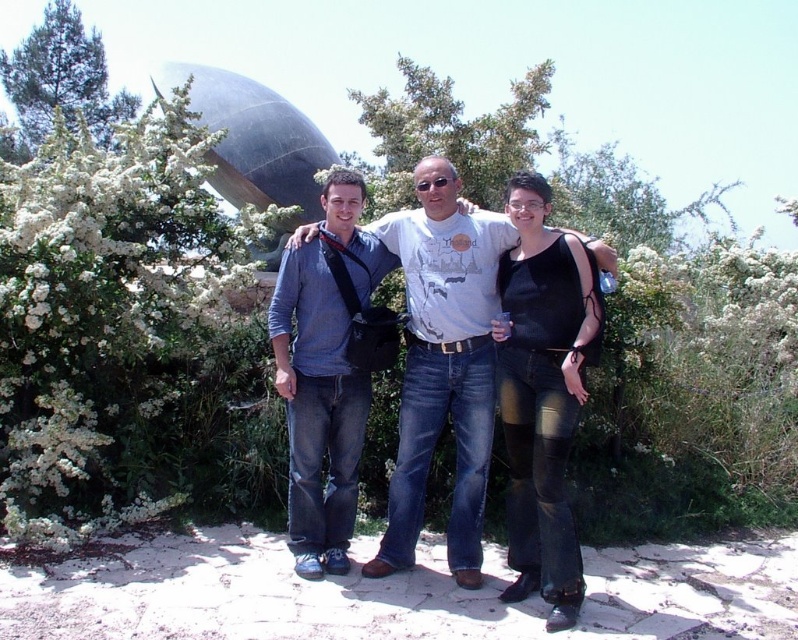
Who is higher up, matte gray t-shirt at center or black mesh top at center?

matte gray t-shirt at center is above.

Is matte gray t-shirt at center shorter than black mesh top at center?

In fact, matte gray t-shirt at center may be taller than black mesh top at center.

Is point (448, 320) positioned in front of point (556, 390)?

No, (448, 320) is further to viewer.

Find the location of a particular element. matte gray t-shirt at center is located at coordinates (444, 364).

Who is positioned more to the left, black mesh top at center or denim jeans at center?

denim jeans at center is more to the left.

This screenshot has height=640, width=798. I want to click on black mesh top at center, so click(x=543, y=394).

Does point (133, 166) come behind point (425, 161)?

Yes, point (133, 166) is farther from viewer.

Which of these two, white fluffy bush at left or matte gray t-shirt at center, stands taller?

With more height is white fluffy bush at left.

Image resolution: width=798 pixels, height=640 pixels. What do you see at coordinates (107, 320) in the screenshot? I see `white fluffy bush at left` at bounding box center [107, 320].

The width and height of the screenshot is (798, 640). I want to click on white fluffy bush at left, so click(107, 320).